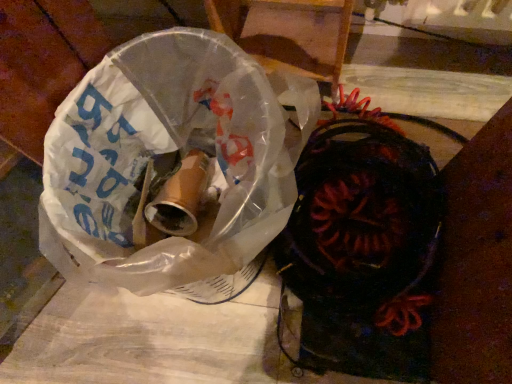
Where is `transparent plastic bag at center`? transparent plastic bag at center is located at coordinates (155, 340).

The width and height of the screenshot is (512, 384). Describe the element at coordinates (155, 340) in the screenshot. I see `transparent plastic bag at center` at that location.

The height and width of the screenshot is (384, 512). Find the location of `transparent plastic bag at center`. transparent plastic bag at center is located at coordinates (155, 340).